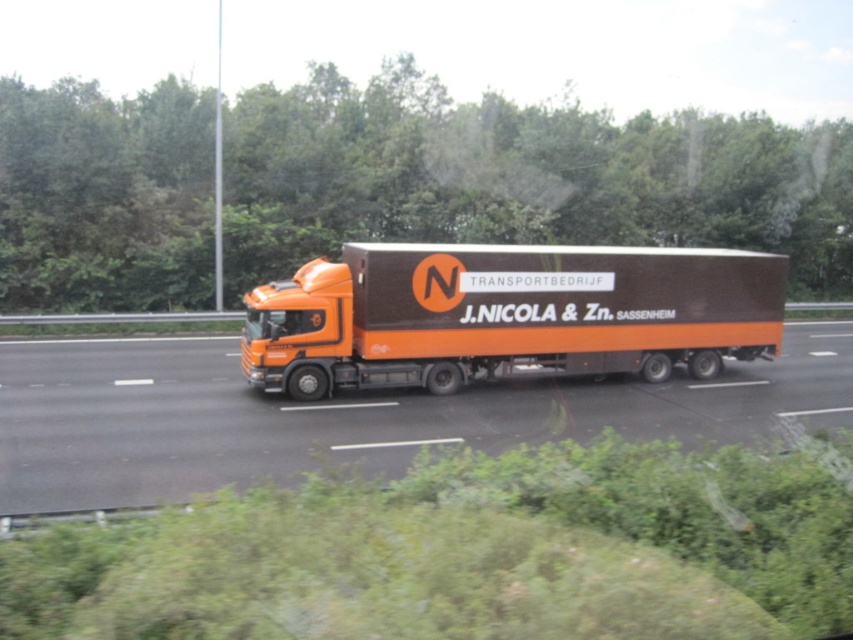
You are a GPS system guiding a driver to a destination. The driver is currently at the orange matte truck at center. The destination is at point 0.650, 0.406. Is the driver already at the destination?

The orange matte truck at center is already at point (345, 416), so the driver is already at the destination.

You are a driver observing the orange matte truck at center and the orange matte trailer truck at center from the side. Which one is positioned lower?

The orange matte truck at center is positioned lower than the orange matte trailer truck at center.

You are a GPS device trying to locate the orange matte truck at center on the highway. The highway has a coordinate system where the bottom left corner is the origin point. The point you found is at coordinate (345,416). Is this point likely to be the orange matte truck at center?

Yes, the point at coordinate (345,416) indicates the orange matte truck at center, so it is likely the correct location.